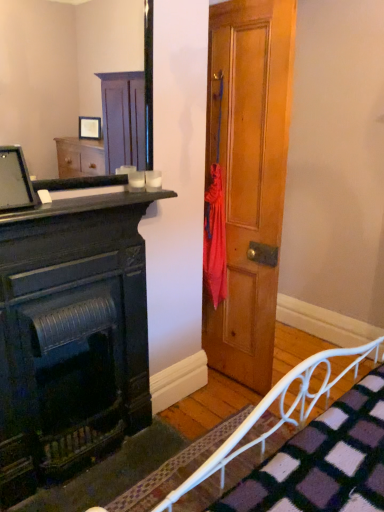
Question: From a real-world perspective, is matte black fireplace at left positioned under wooden frame mirror at upper left based on gravity?

Choices:
 (A) no
 (B) yes

Answer: (B)

Question: Is matte black fireplace at left closer to the viewer compared to wooden frame mirror at upper left?

Choices:
 (A) yes
 (B) no

Answer: (B)

Question: Are matte black fireplace at left and wooden frame mirror at upper left located far from each other?

Choices:
 (A) no
 (B) yes

Answer: (B)

Question: Is matte black fireplace at left positioned with its back to wooden frame mirror at upper left?

Choices:
 (A) no
 (B) yes

Answer: (A)

Question: Does matte black fireplace at left have a greater height compared to wooden frame mirror at upper left?

Choices:
 (A) yes
 (B) no

Answer: (A)

Question: Choose the correct answer: Is matte black fireplace at left inside wooden door at center or outside it?

Choices:
 (A) outside
 (B) inside

Answer: (A)

Question: From a real-world perspective, is matte black fireplace at left physically located above or below wooden door at center?

Choices:
 (A) below
 (B) above

Answer: (A)

Question: Does point (92, 320) appear closer or farther from the camera than point (284, 82)?

Choices:
 (A) closer
 (B) farther

Answer: (A)

Question: Is matte black fireplace at left in front of or behind wooden door at center in the image?

Choices:
 (A) behind
 (B) front

Answer: (B)

Question: Considering the positions of point (226, 262) and point (33, 188), is point (226, 262) closer or farther from the camera than point (33, 188)?

Choices:
 (A) farther
 (B) closer

Answer: (A)

Question: Would you say wooden door at center is to the left or to the right of matte black monitor at upper left in the picture?

Choices:
 (A) left
 (B) right

Answer: (B)

Question: From a real-world perspective, is wooden door at center above or below matte black monitor at upper left?

Choices:
 (A) above
 (B) below

Answer: (B)

Question: Is wooden door at center wider or thinner than matte black monitor at upper left?

Choices:
 (A) wide
 (B) thin

Answer: (A)

Question: Looking at their shapes, would you say white metal bed frame at lower right is wider or thinner than matte black monitor at upper left?

Choices:
 (A) wide
 (B) thin

Answer: (A)

Question: From the image's perspective, relative to matte black monitor at upper left, is white metal bed frame at lower right above or below?

Choices:
 (A) below
 (B) above

Answer: (A)